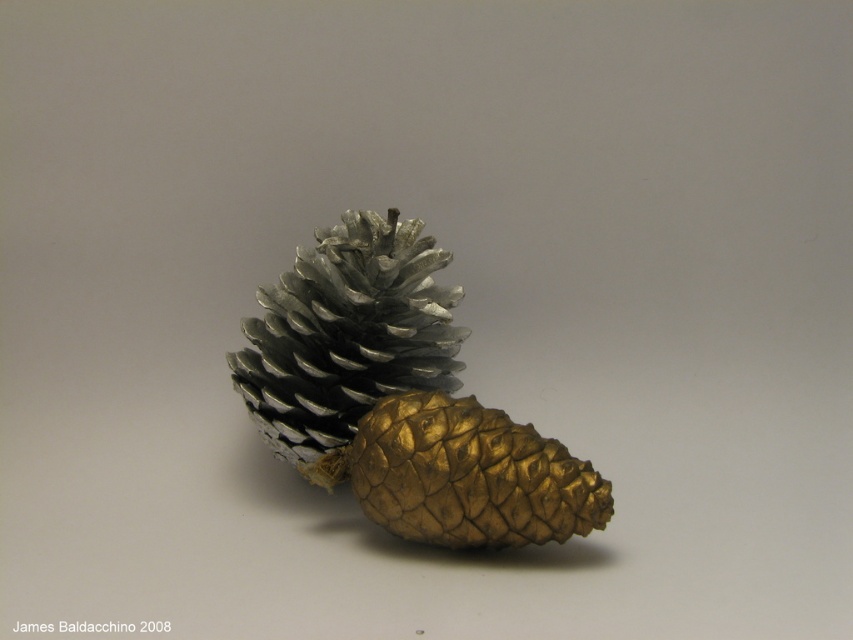
Question: Among these points, which one is nearest to the camera?

Choices:
 (A) (335, 378)
 (B) (392, 385)

Answer: (A)

Question: Can you confirm if gold metallic pinecone at center is positioned above metallic silver pine cone at center?

Choices:
 (A) no
 (B) yes

Answer: (A)

Question: Can you confirm if gold metallic pinecone at center is bigger than metallic silver pine cone at center?

Choices:
 (A) yes
 (B) no

Answer: (A)

Question: Is gold metallic pinecone at center above metallic silver pine cone at center?

Choices:
 (A) no
 (B) yes

Answer: (A)